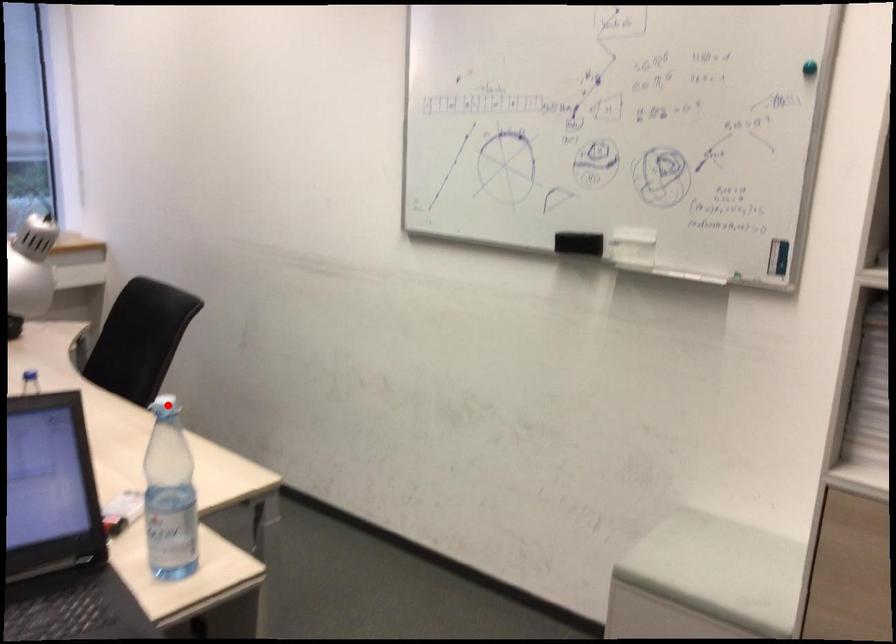
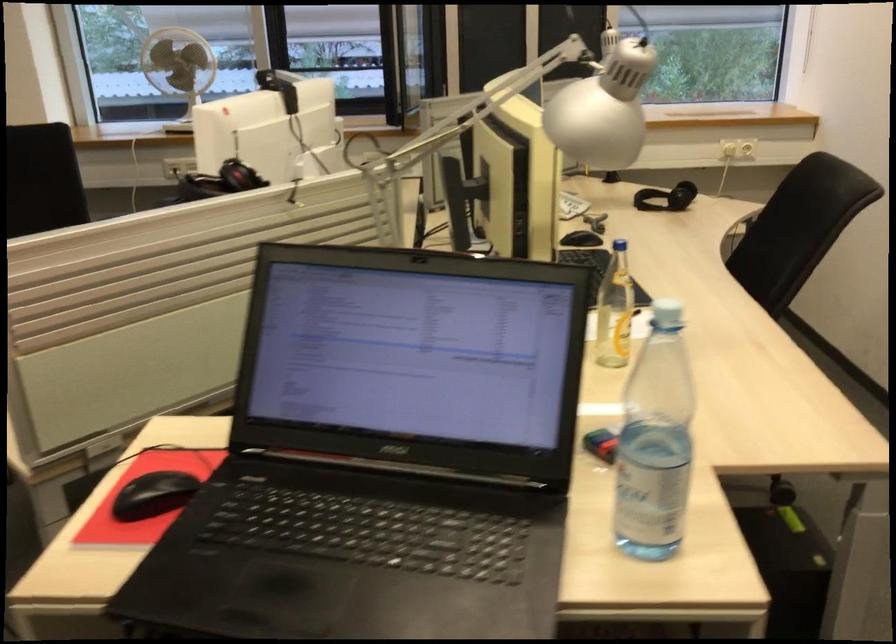
Question: A red point is marked in image1. In image2, is the corresponding 3D point closer to the camera or farther? Reply with the corresponding letter.

Choices:
 (A) The corresponding 3D point is closer.
 (B) The corresponding 3D point is farther.

Answer: (A)